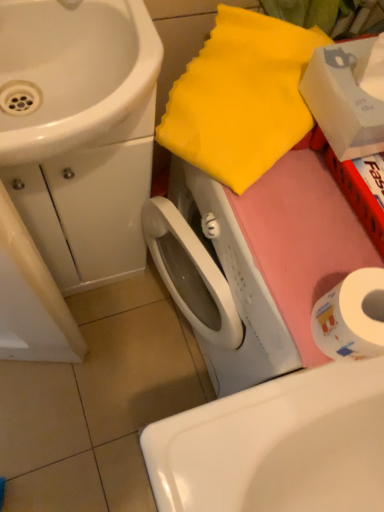
Question: From a real-world perspective, does white glossy sink at lower center, which ranks as the second sink in top-to-bottom order, stand above white paper at lower right?

Choices:
 (A) yes
 (B) no

Answer: (B)

Question: From the image's perspective, is white glossy sink at lower center, positioned as the 1th sink in right-to-left order, beneath white paper at lower right?

Choices:
 (A) yes
 (B) no

Answer: (A)

Question: Considering the relative sizes of white glossy sink at lower center, which is counted as the 1th sink, starting from the bottom, and white paper at lower right in the image provided, is white glossy sink at lower center, which is counted as the 1th sink, starting from the bottom, smaller than white paper at lower right?

Choices:
 (A) yes
 (B) no

Answer: (B)

Question: From a real-world perspective, is white glossy sink at lower center, positioned as the 1th sink in right-to-left order, under white paper at lower right?

Choices:
 (A) no
 (B) yes

Answer: (B)

Question: Is white glossy sink at lower center, which is counted as the 1th sink, starting from the bottom, taller than white paper at lower right?

Choices:
 (A) no
 (B) yes

Answer: (B)

Question: Can you confirm if white glossy sink at lower center, which ranks as the second sink in top-to-bottom order, is thinner than white paper at lower right?

Choices:
 (A) no
 (B) yes

Answer: (A)

Question: Is white cardboard box at upper right completely or partially outside of yellow fabric at upper right?

Choices:
 (A) no
 (B) yes

Answer: (B)

Question: Is white cardboard box at upper right at the left side of yellow fabric at upper right?

Choices:
 (A) no
 (B) yes

Answer: (A)

Question: Is white cardboard box at upper right positioned before yellow fabric at upper right?

Choices:
 (A) yes
 (B) no

Answer: (A)

Question: Does white cardboard box at upper right have a smaller size compared to yellow fabric at upper right?

Choices:
 (A) no
 (B) yes

Answer: (B)

Question: Are white cardboard box at upper right and yellow fabric at upper right far apart?

Choices:
 (A) yes
 (B) no

Answer: (B)

Question: Can you confirm if white cardboard box at upper right is thinner than yellow fabric at upper right?

Choices:
 (A) yes
 (B) no

Answer: (A)

Question: Is white glossy sink at lower center, which ranks as the second sink in top-to-bottom order, facing away from white glossy sink at upper left, placed as the 1th sink when sorted from left to right?

Choices:
 (A) yes
 (B) no

Answer: (B)